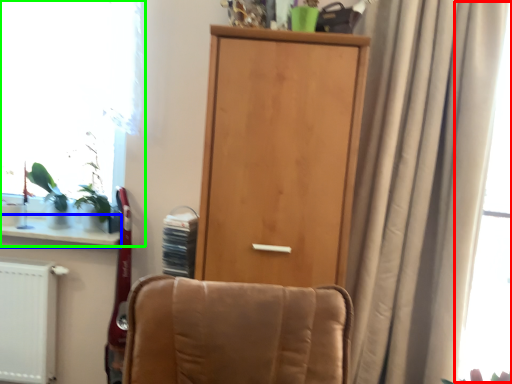
Question: Considering the real-world distances, which object is farthest from window screen (highlighted by a red box)? window sill (highlighted by a blue box) or window (highlighted by a green box)?

Choices:
 (A) window sill
 (B) window

Answer: (A)